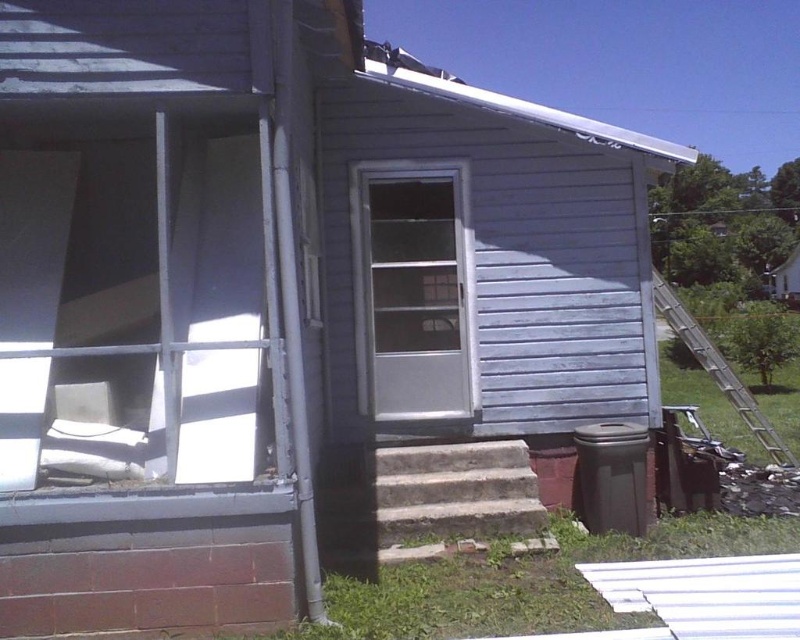
Question: Considering the relative positions of clear glass door at center and metallic silver ladder at right in the image provided, where is clear glass door at center located with respect to metallic silver ladder at right?

Choices:
 (A) left
 (B) right

Answer: (A)

Question: Observing the image, what is the correct spatial positioning of clear glass door at center in reference to metallic silver ladder at right?

Choices:
 (A) right
 (B) left

Answer: (B)

Question: Is clear glass door at center thinner than metallic silver ladder at right?

Choices:
 (A) no
 (B) yes

Answer: (A)

Question: Which object appears closest to the camera in this image?

Choices:
 (A) clear glass door at center
 (B) metallic silver ladder at right

Answer: (A)

Question: Which point is closer to the camera taking this photo?

Choices:
 (A) (362, 161)
 (B) (770, 435)

Answer: (A)